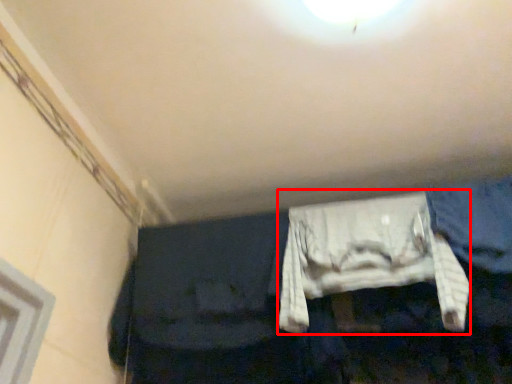
Question: From the image's perspective, where is clothing (annotated by the red box) located relative to jeans?

Choices:
 (A) below
 (B) above

Answer: (A)